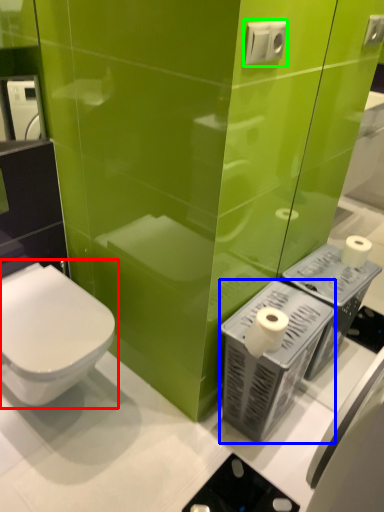
Question: Considering the real-world distances, which object is closest to toilet (highlighted by a red box)? appliance (highlighted by a blue box) or electric outlet (highlighted by a green box).

Choices:
 (A) appliance
 (B) electric outlet

Answer: (A)